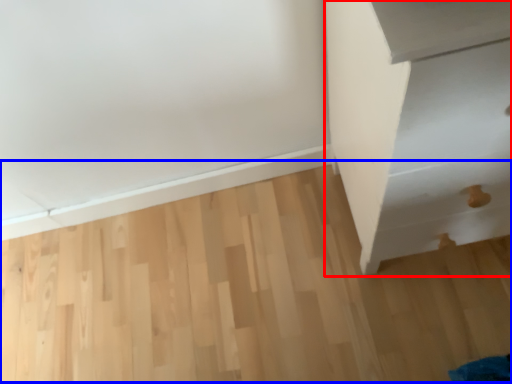
Question: Which object appears farthest to the camera in this image, furniture (highlighted by a red box) or plywood (highlighted by a blue box)?

Choices:
 (A) furniture
 (B) plywood

Answer: (B)